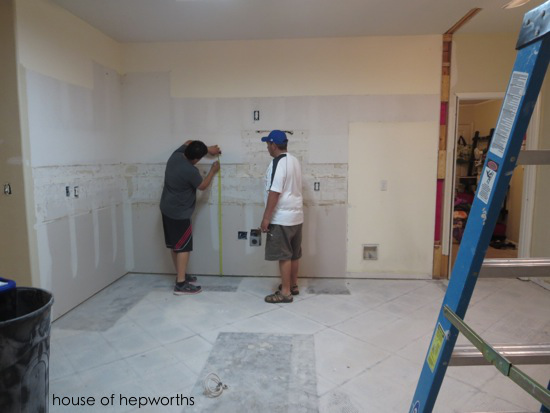
Locate an element on the screen. This screenshot has height=413, width=550. doorway is located at coordinates (452, 132).